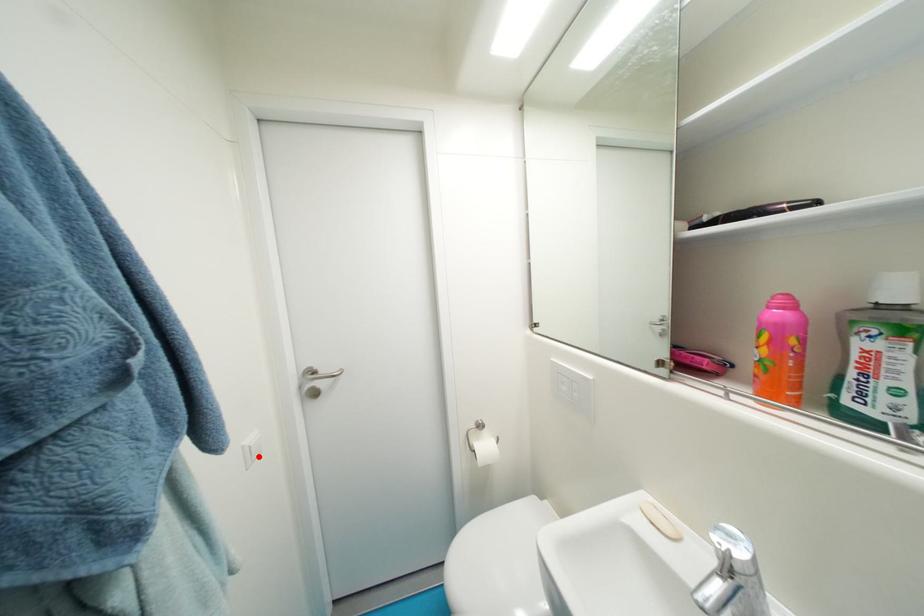
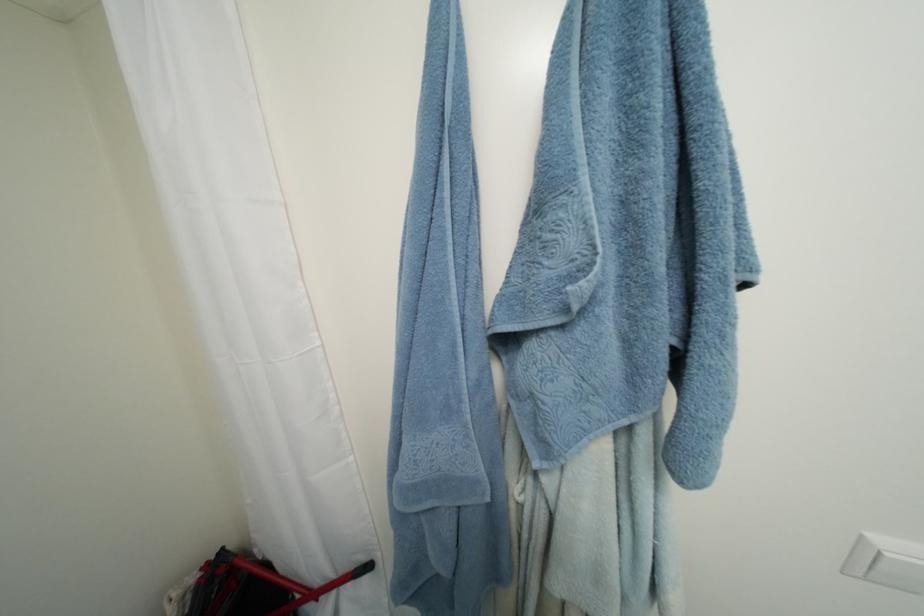
Locate, in the second image, the point that corresponds to the highlighted location in the first image.

(880, 570)